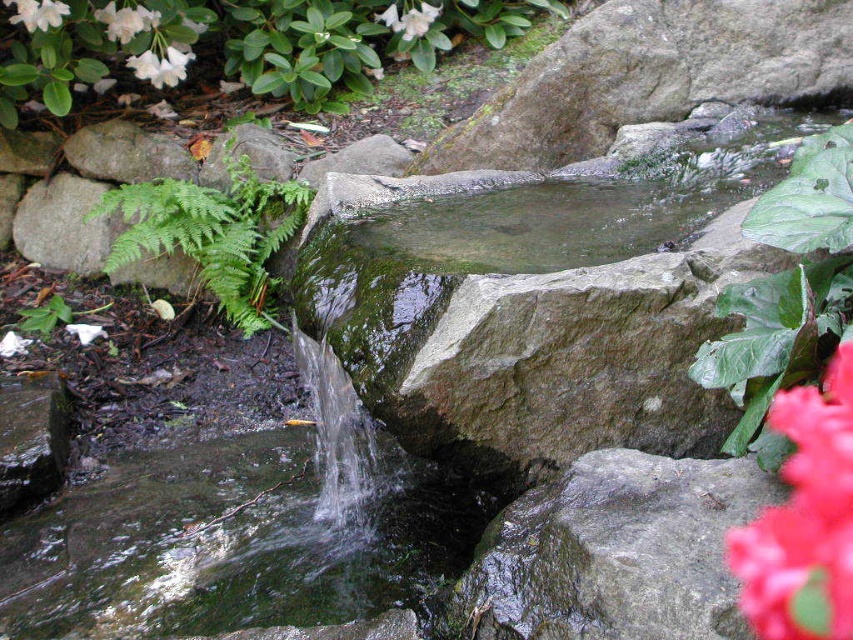
You are a gardener planning to prune the green leafy fern at left. If you remove part of it, will the white matte flower at upper left become more visible? Explain why based on their positions.

Yes, the white matte flower at upper left will become more visible because it is currently positioned behind the green leafy fern at left. Removing part of the fern will reduce the obstruction, allowing the flower to be seen more clearly.

In the garden scene, you see a clear water stream at center and vivid red petals at lower right. Which object takes up more space in the image?

The clear water stream at center has a larger size compared to the vivid red petals at lower right, so it takes up more space in the image.